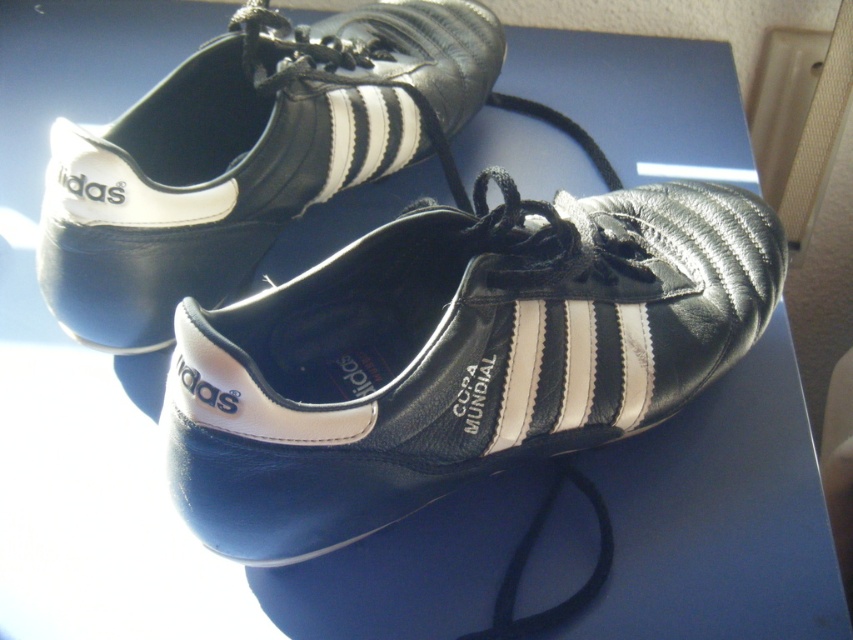
Question: Where is black leather shoe at center located in relation to shiny leather shoe at upper center in the image?

Choices:
 (A) below
 (B) above

Answer: (A)

Question: Which point appears closest to the camera in this image?

Choices:
 (A) (387, 474)
 (B) (379, 64)

Answer: (A)

Question: Does black leather shoe at center appear over shiny leather shoe at upper center?

Choices:
 (A) no
 (B) yes

Answer: (A)

Question: Among these points, which one is nearest to the camera?

Choices:
 (A) (715, 339)
 (B) (410, 24)

Answer: (A)

Question: Which object is farther from the camera taking this photo?

Choices:
 (A) shiny leather shoe at upper center
 (B) black leather shoe at center

Answer: (A)

Question: Where is black leather shoe at center located in relation to shiny leather shoe at upper center in the image?

Choices:
 (A) left
 (B) right

Answer: (B)